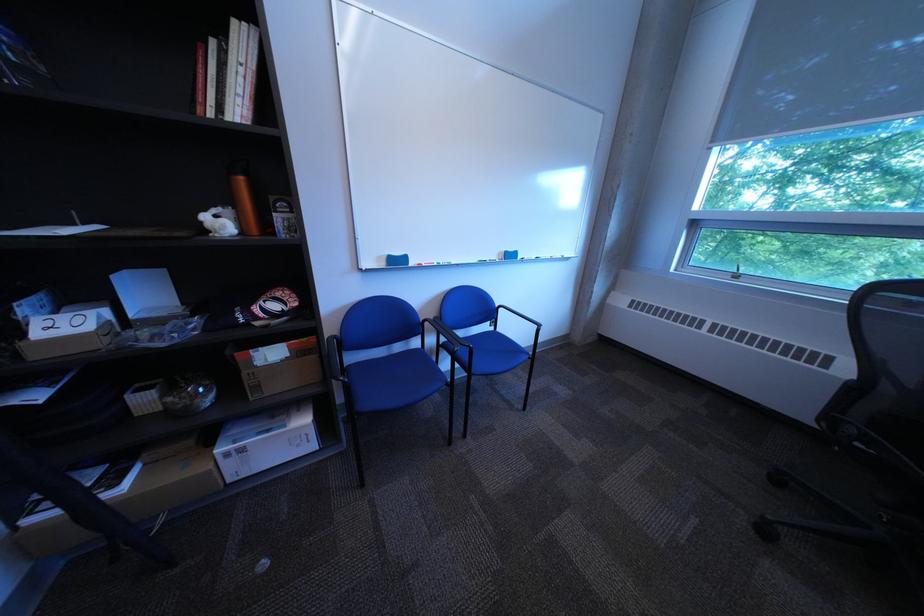
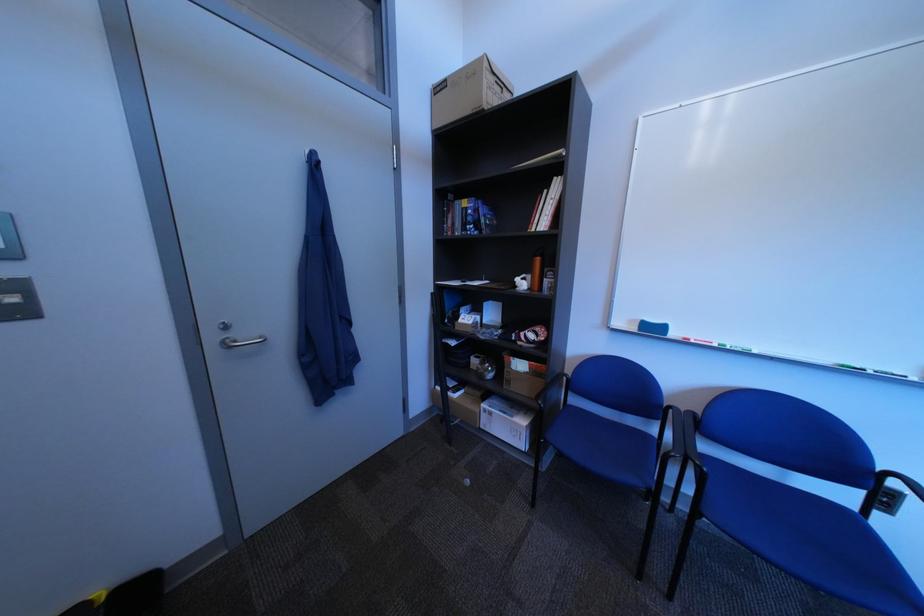
Find the pixel in the second image that matches the point at 451,265 in the first image.

(732, 347)